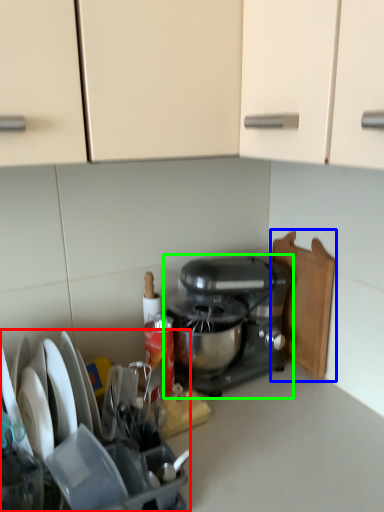
Question: Which object is positioned farthest from appliance (highlighted by a red box)? Select from cutting board (highlighted by a blue box) and mixer (highlighted by a green box).

Choices:
 (A) cutting board
 (B) mixer

Answer: (A)